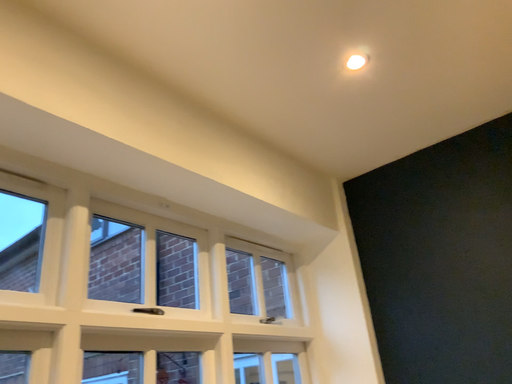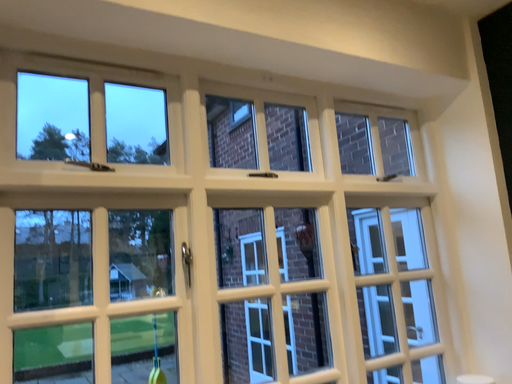
Question: How did the camera likely rotate when shooting the video?

Choices:
 (A) rotated right
 (B) rotated left

Answer: (B)